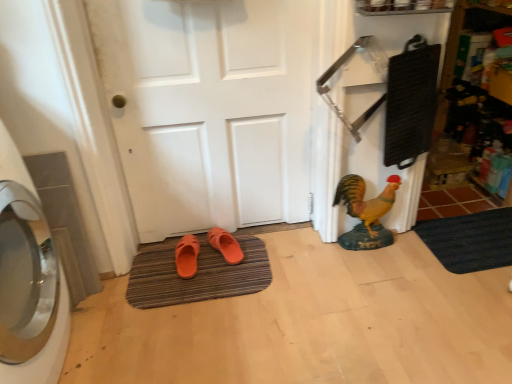
Locate an element on the screen. This screenshot has height=384, width=512. vacant region to the right of shiny yellow statue at right is located at coordinates (408, 251).